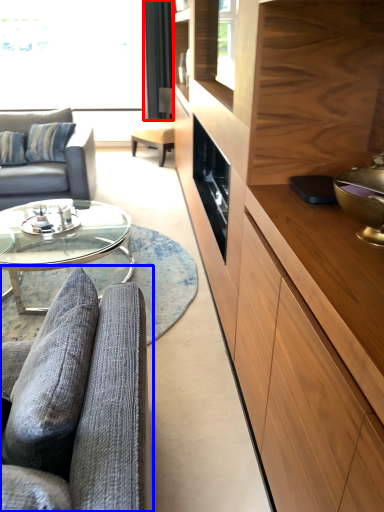
Question: Among these objects, which one is farthest to the camera, curtain (highlighted by a red box) or studio couch (highlighted by a blue box)?

Choices:
 (A) curtain
 (B) studio couch

Answer: (A)